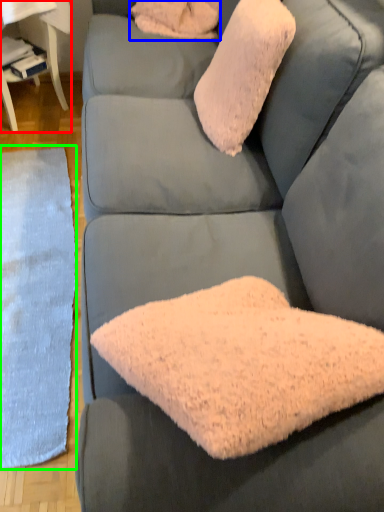
Question: Based on their relative distances, which object is nearer to table (highlighted by a red box)? Choose from pillow (highlighted by a blue box) and mat (highlighted by a green box).

Choices:
 (A) pillow
 (B) mat

Answer: (A)